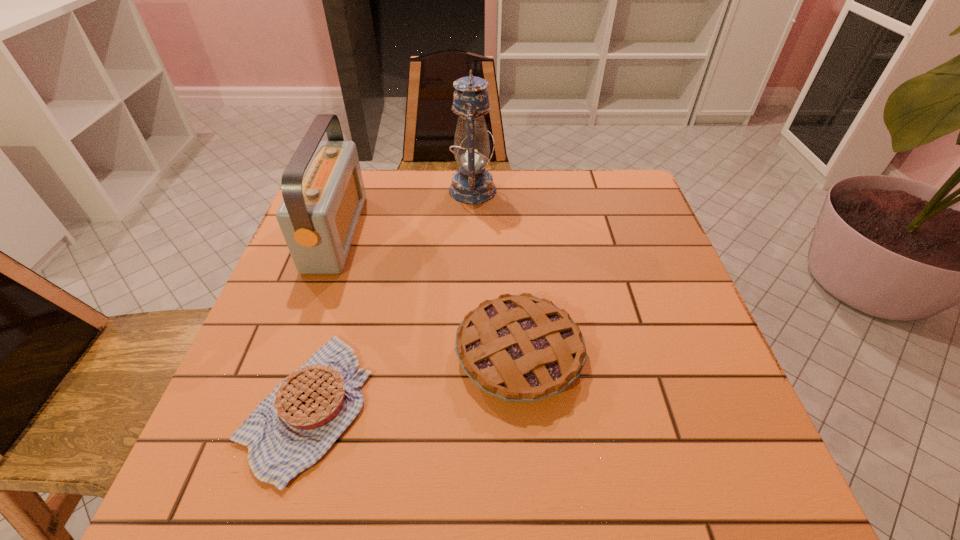
What are the coordinates of `vacant space that satisfies the following two spatial constraints: 1. on the front-facing side of the third tallest object; 2. on the right side of the radio receiver` in the screenshot? It's located at (292, 354).

Where is `vacant space that satisfies the following two spatial constraints: 1. on the front-facing side of the right pie; 2. on the right side of the lantern`? The height and width of the screenshot is (540, 960). vacant space that satisfies the following two spatial constraints: 1. on the front-facing side of the right pie; 2. on the right side of the lantern is located at coordinates (469, 354).